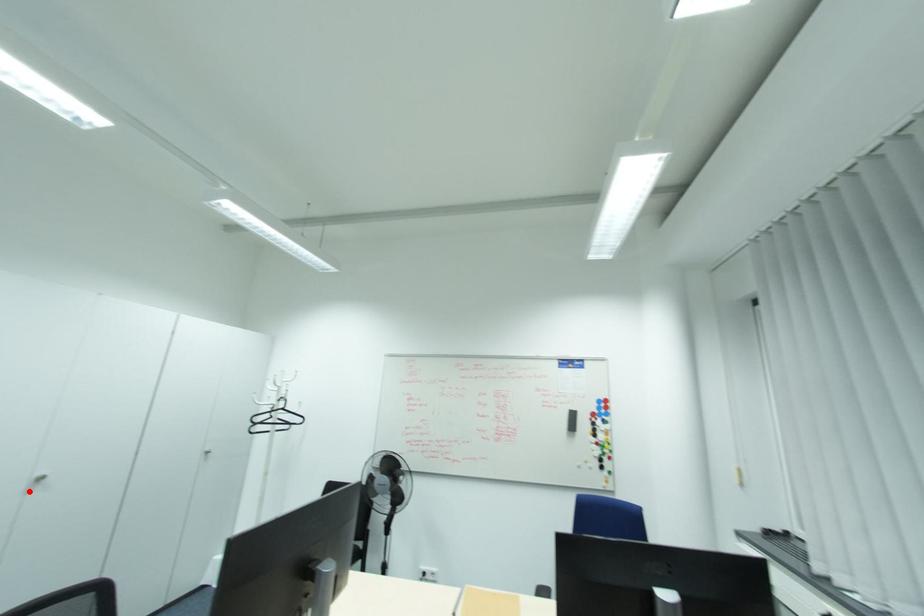
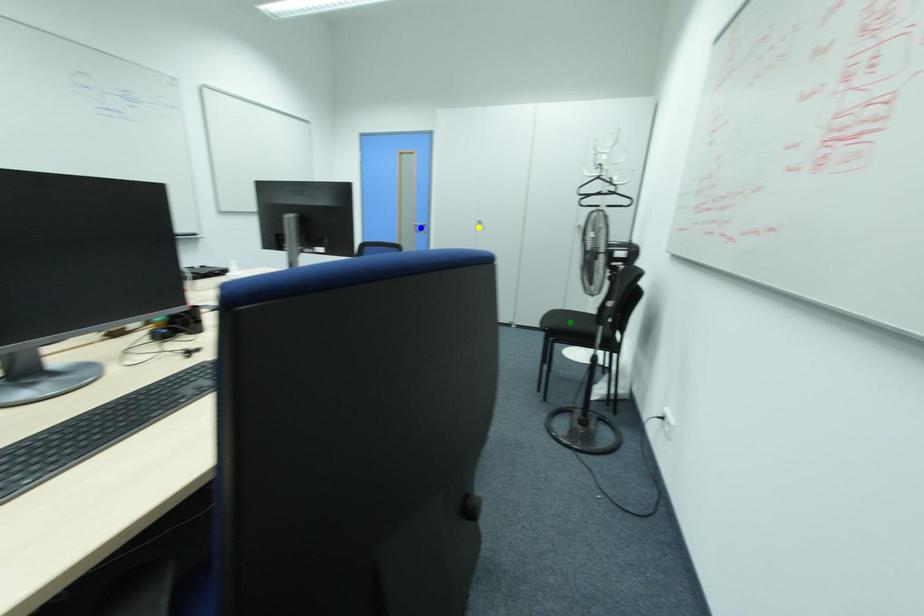
Question: I am providing you with two images of the same scene from different viewpoints. A red point is marked on the first image. You are given multiple points on the second image. Which point in image 2 represents the same 3d spot as the red point in image 1?

Choices:
 (A) yellow point
 (B) green point
 (C) blue point

Answer: (A)